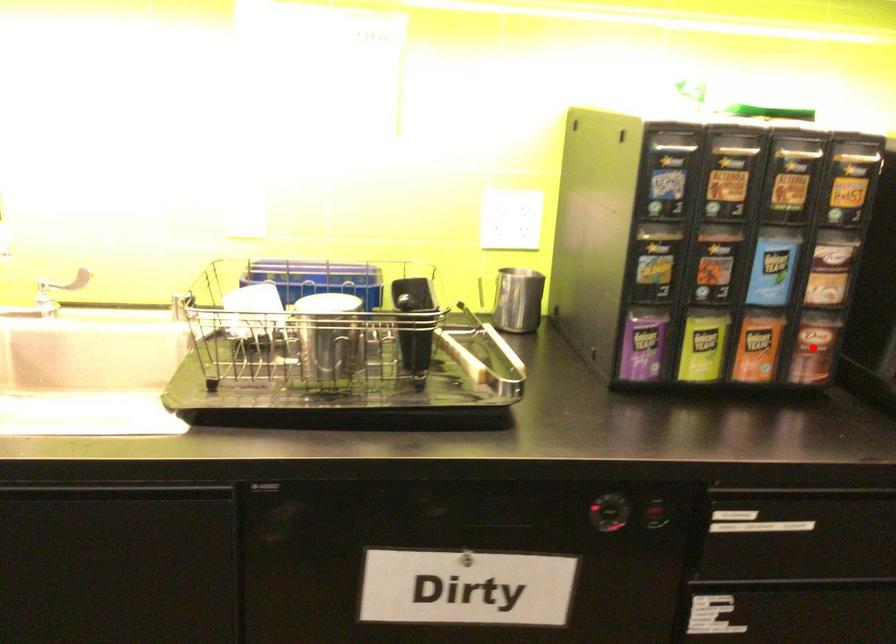
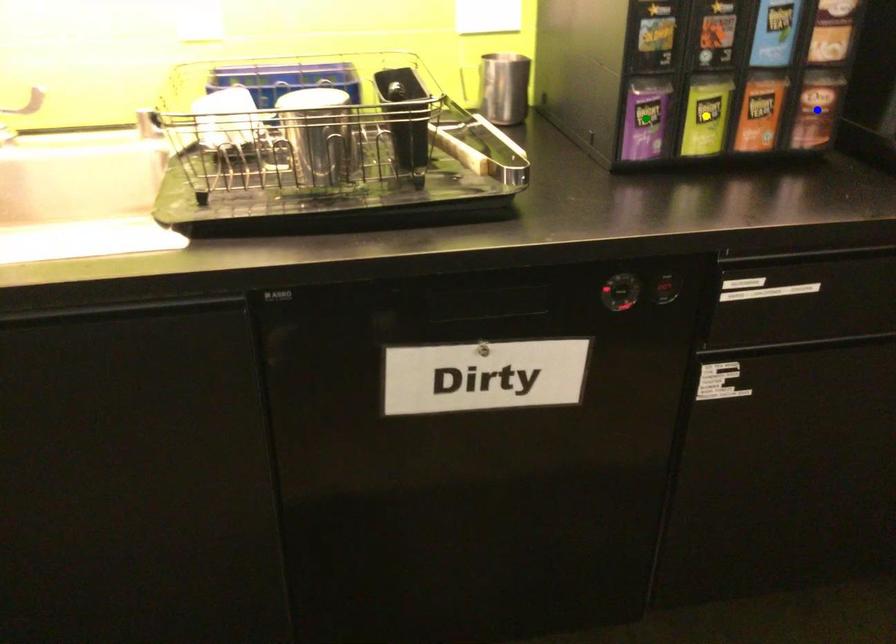
Question: I am providing you with two images of the same scene from different viewpoints. A red point is marked on the first image. You are given multiple points on the second image. Which point in image 2 is actually the same real-world point as the red point in image 1?

Choices:
 (A) green point
 (B) yellow point
 (C) blue point

Answer: (C)